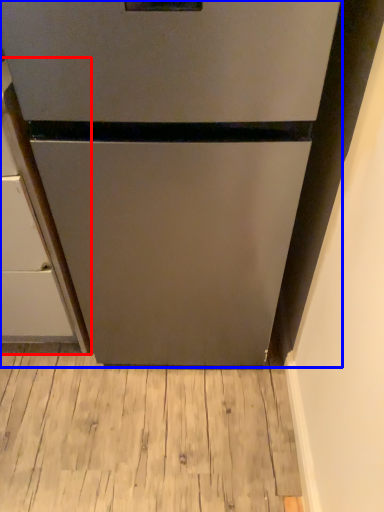
Question: Which object appears farthest to the camera in this image, cabinetry (highlighted by a red box) or refrigerator (highlighted by a blue box)?

Choices:
 (A) cabinetry
 (B) refrigerator

Answer: (A)